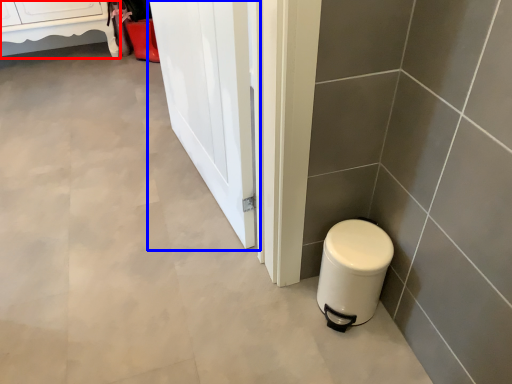
Question: Which point is closer to the camera, furniture (highlighted by a red box) or screen door (highlighted by a blue box)?

Choices:
 (A) furniture
 (B) screen door

Answer: (B)